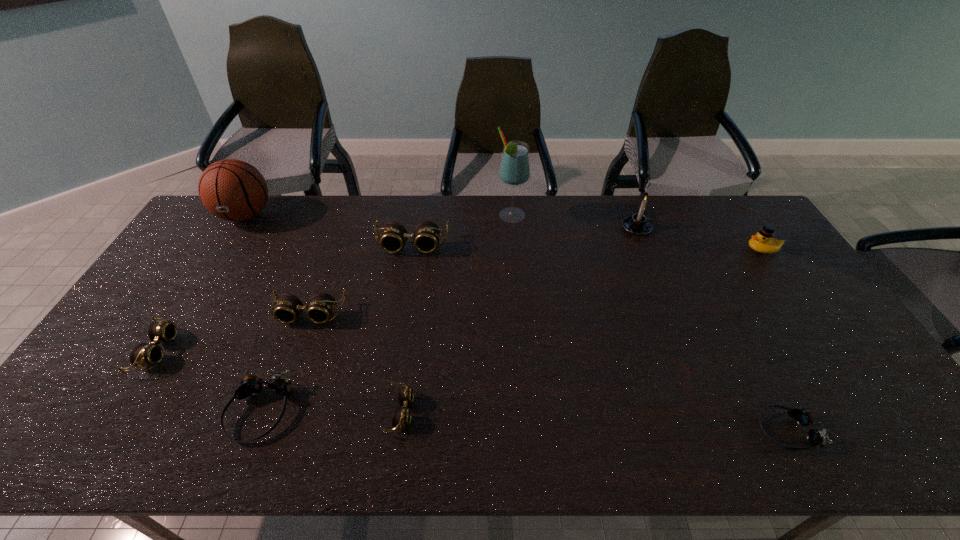
You are a GUI agent. You are given a task and a screenshot of the screen. Output one action in this format:
    pyautogui.click(x=<x>, y=<y>)
    Task: Click on the second brown goggles from left to right
    
    Given the screenshot: What is the action you would take?
    pyautogui.click(x=321, y=306)

You are a GUI agent. You are given a task and a screenshot of the screen. Output one action in this format:
    pyautogui.click(x=<x>, y=<y>)
    Task: Click on the second biggest brown goggles
    Image resolution: width=960 pixels, height=540 pixels.
    Given the screenshot: What is the action you would take?
    pyautogui.click(x=321, y=306)

Locate an element on the screen. This screenshot has width=960, height=540. the third biggest brown goggles is located at coordinates (143, 354).

Identify the location of the leftmost goggles. (143, 354).

The height and width of the screenshot is (540, 960). What are the coordinates of `the left bronze goggles` in the screenshot? It's located at point(251,385).

Where is `the smallest brown goggles`? the smallest brown goggles is located at coordinates (401, 417).

I want to click on the rightmost goggles, so click(803, 417).

Identify the location of the right bronze goggles. (803, 417).

The image size is (960, 540). Identify the location of vacant position located 0.270m on the front of the seventh object from left to right. (516, 281).

You are a GUI agent. You are given a task and a screenshot of the screen. Output one action in this format:
    pyautogui.click(x=<x>, y=<y>)
    Task: Click on the vacant point located on the side where the inflation valve is located
    Image resolution: width=960 pixels, height=540 pixels.
    Given the screenshot: What is the action you would take?
    pyautogui.click(x=202, y=286)